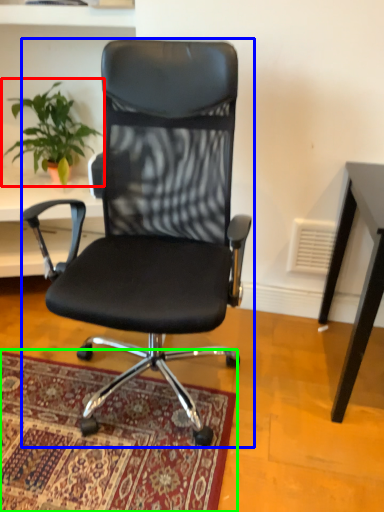
Question: Estimate the real-world distances between objects in this image. Which object is closer to houseplant (highlighted by a red box), chair (highlighted by a blue box) or mat (highlighted by a green box)?

Choices:
 (A) chair
 (B) mat

Answer: (A)